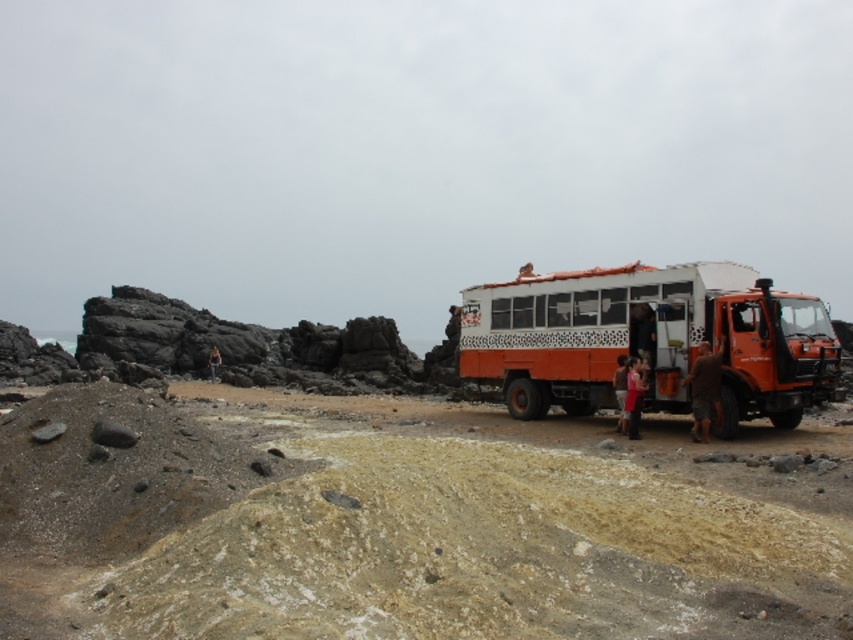
Is orange matte truck at center to the left of brown fabric shorts at right from the viewer's perspective?

Indeed, orange matte truck at center is positioned on the left side of brown fabric shorts at right.

What do you see at coordinates (648, 339) in the screenshot? The image size is (853, 640). I see `orange matte truck at center` at bounding box center [648, 339].

In order to click on orange matte truck at center in this screenshot , I will do 648,339.

Between orange matte truck at center and red fabric shirt at center, which one has more height?

orange matte truck at center

Who is positioned more to the right, orange matte truck at center or red fabric shirt at center?

red fabric shirt at center is more to the right.

Is point (762, 289) positioned before point (636, 433)?

Yes, point (762, 289) is in front of point (636, 433).

This screenshot has width=853, height=640. Find the location of `orange matte truck at center`. orange matte truck at center is located at coordinates (648, 339).

Does point (161, 492) come in front of point (218, 358)?

Yes, point (161, 492) is closer to viewer.

Is point (669, 580) behind point (219, 358)?

No, it is not.

Find the location of `smooth sand at center`. smooth sand at center is located at coordinates (404, 525).